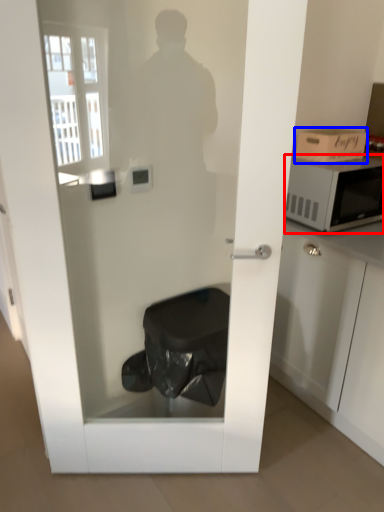
Question: Among these objects, which one is farthest to the camera, microwave oven (highlighted by a red box) or cardboard box (highlighted by a blue box)?

Choices:
 (A) microwave oven
 (B) cardboard box

Answer: (B)